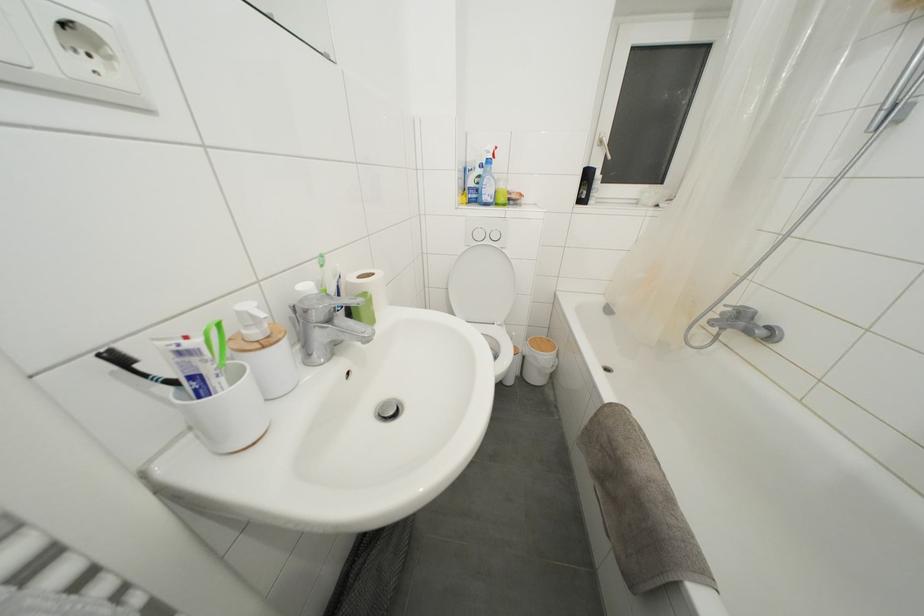
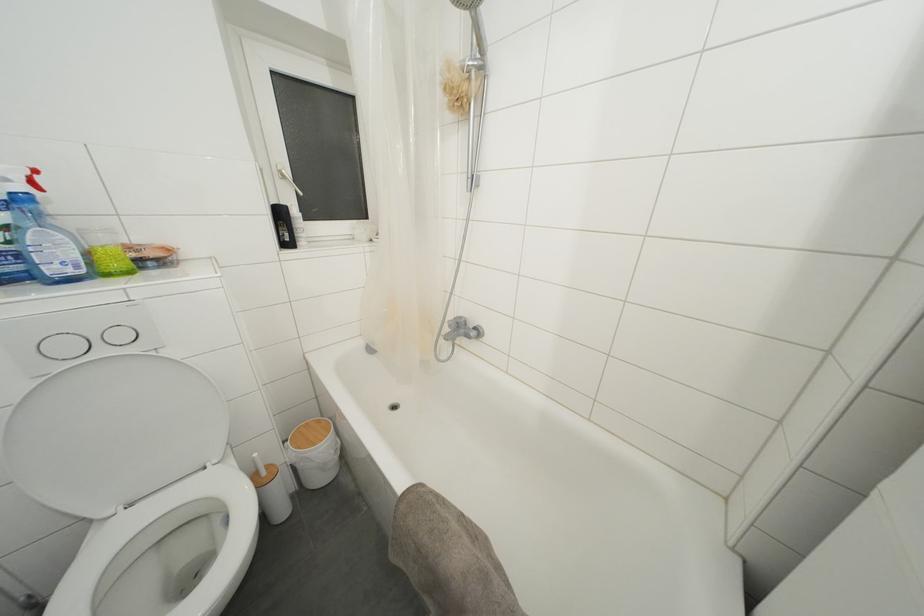
Locate, in the second image, the point that corresponds to the point at 736,306 in the first image.

(455, 321)